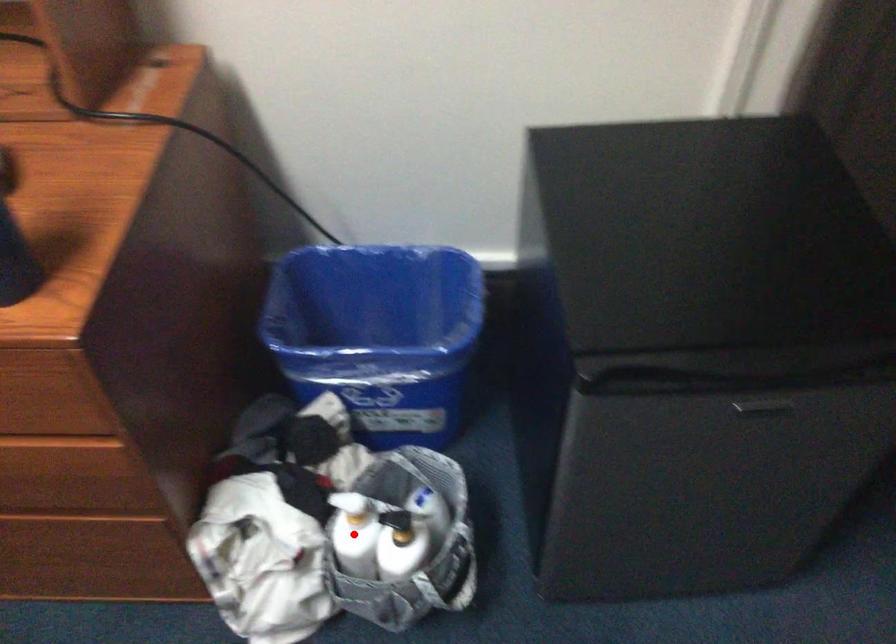
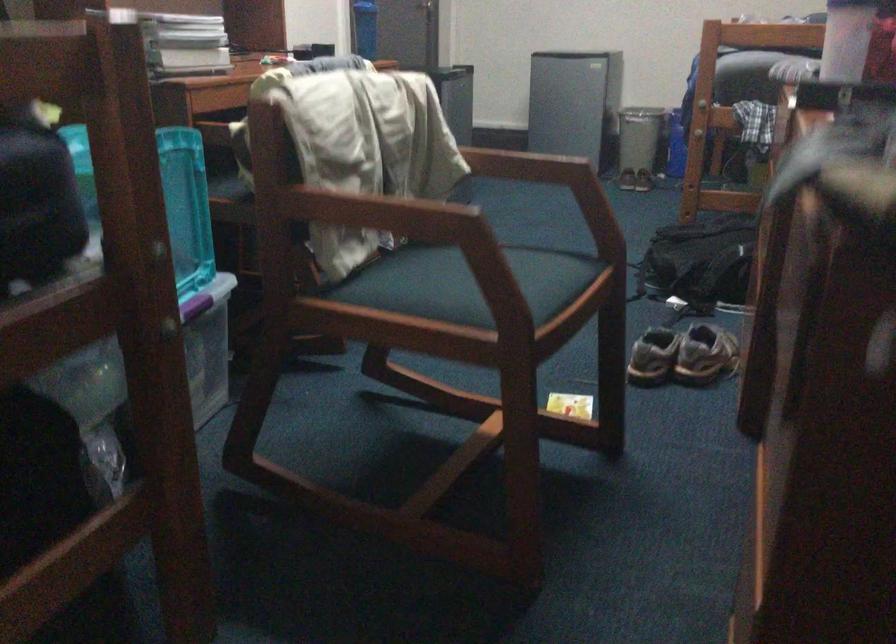
Question: I am providing you with two images of the same scene from different viewpoints. A red point is marked on the first image. Is the red point's position out of view in image 2?

Choices:
 (A) Yes
 (B) No

Answer: (A)